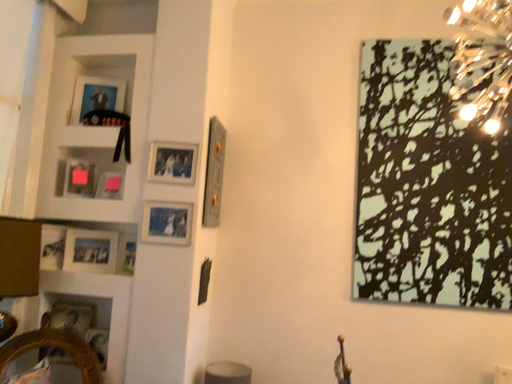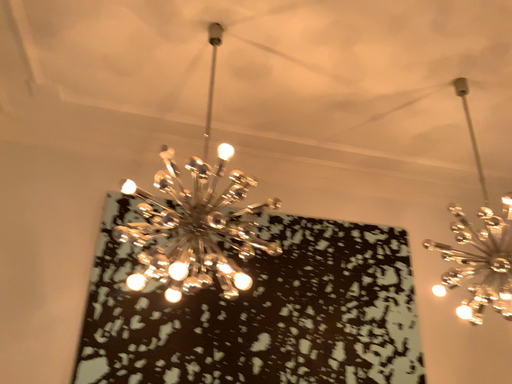
Question: Which way did the camera rotate in the video?

Choices:
 (A) rotated left
 (B) rotated right

Answer: (B)